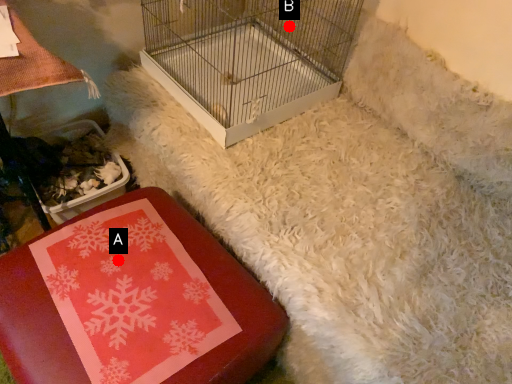
Question: Two points are circled on the image, labeled by A and B beside each circle. Among these points, which one is nearest to the camera?

Choices:
 (A) A is closer
 (B) B is closer

Answer: (A)